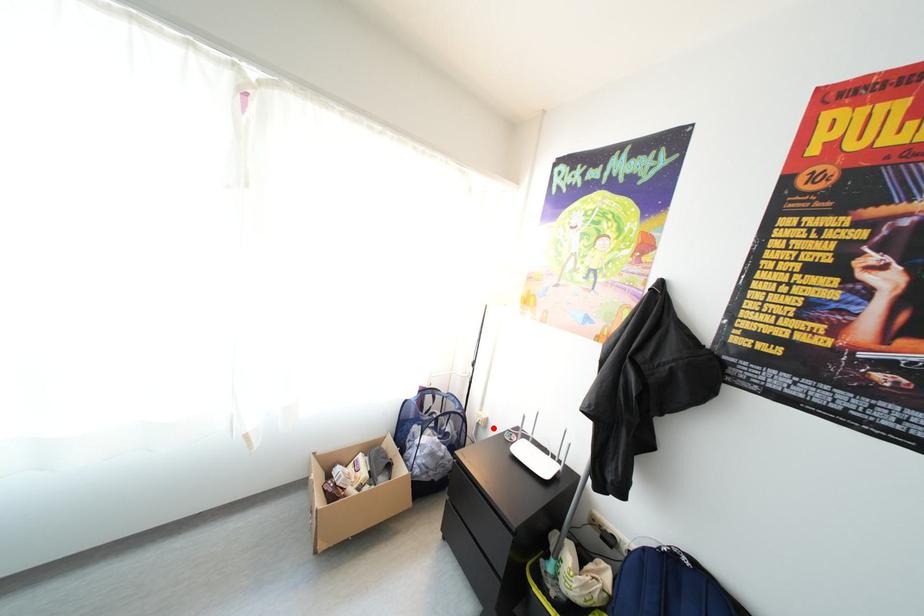
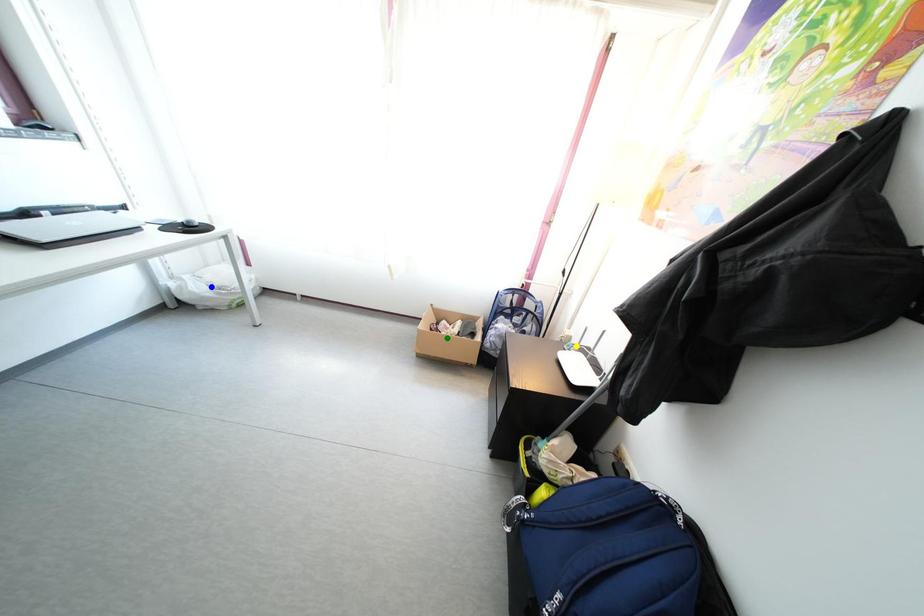
Question: I am providing you with two images of the same scene from different viewpoints. A red point is marked on the first image. You are given multiple points on the second image. Which point in image 2 is actually the same real-world point as the red point in image 1?

Choices:
 (A) blue point
 (B) yellow point
 (C) green point

Answer: (B)